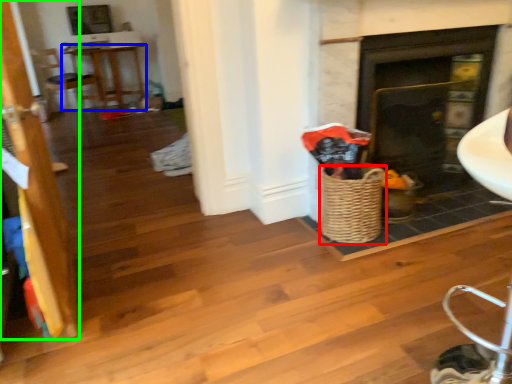
Question: Which is nearer to the basket (highlighted by a red box)? table (highlighted by a blue box) or door (highlighted by a green box).

Choices:
 (A) table
 (B) door

Answer: (B)